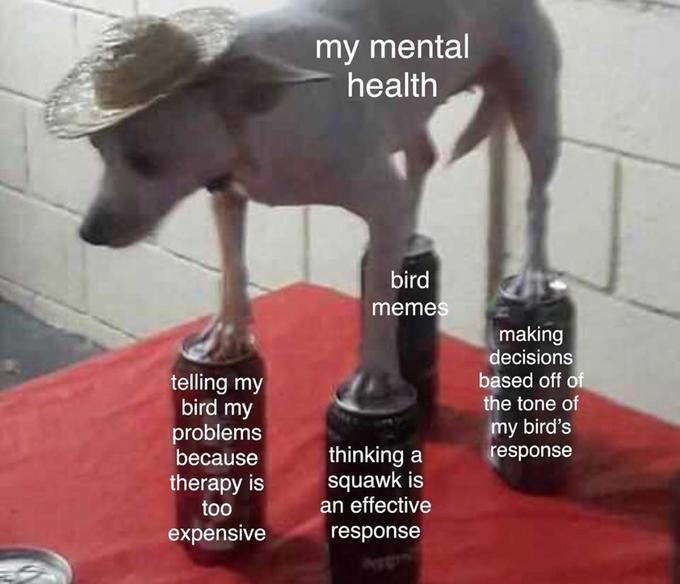
Find the location of a particular element. white brick wall is located at coordinates tap(52, 245).